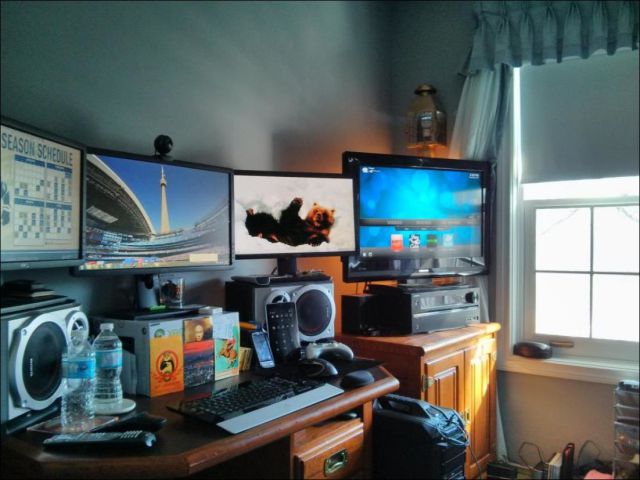
The width and height of the screenshot is (640, 480). Find the location of `computer monitor`. computer monitor is located at coordinates (265, 195), (188, 195), (36, 195).